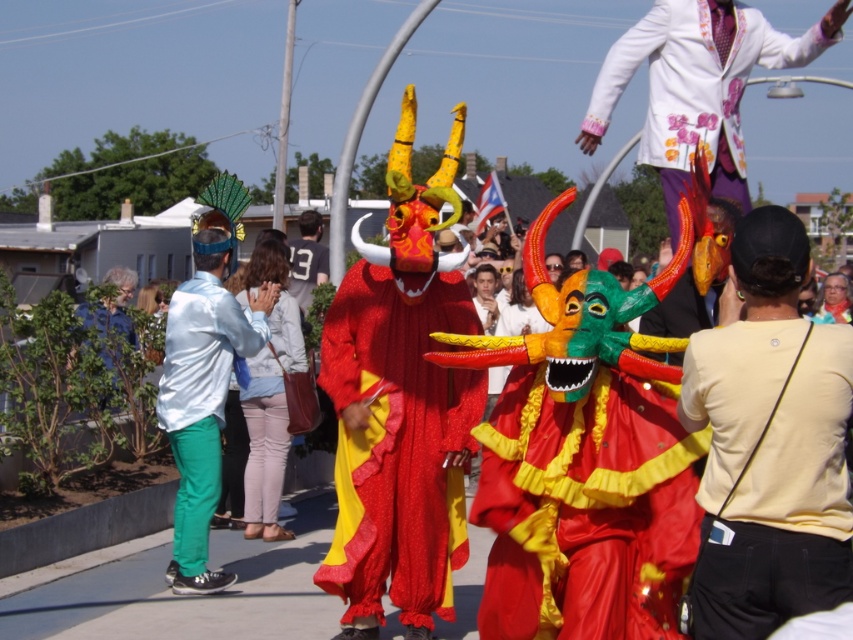
Between shiny red fabric dragon at center and green fabric jacket at lower left, which one appears on the right side from the viewer's perspective?

shiny red fabric dragon at center is more to the right.

Does shiny red fabric dragon at center appear over green fabric jacket at lower left?

Yes, shiny red fabric dragon at center is above green fabric jacket at lower left.

Which is in front, point (329, 548) or point (90, 305)?

Point (329, 548)

Find the location of a particular element. shiny red fabric dragon at center is located at coordinates (399, 404).

Is green cotton pants at center to the right of light blue denim jacket at center from the viewer's perspective?

In fact, green cotton pants at center is to the left of light blue denim jacket at center.

Identify the location of green cotton pants at center. This screenshot has height=640, width=853. (202, 403).

Which is above, gray cotton t-shirt at center or green fabric jacket at lower left?

Positioned higher is gray cotton t-shirt at center.

Which is in front, point (311, 216) or point (107, 326)?

Point (107, 326)

I want to click on gray cotton t-shirt at center, so click(306, 259).